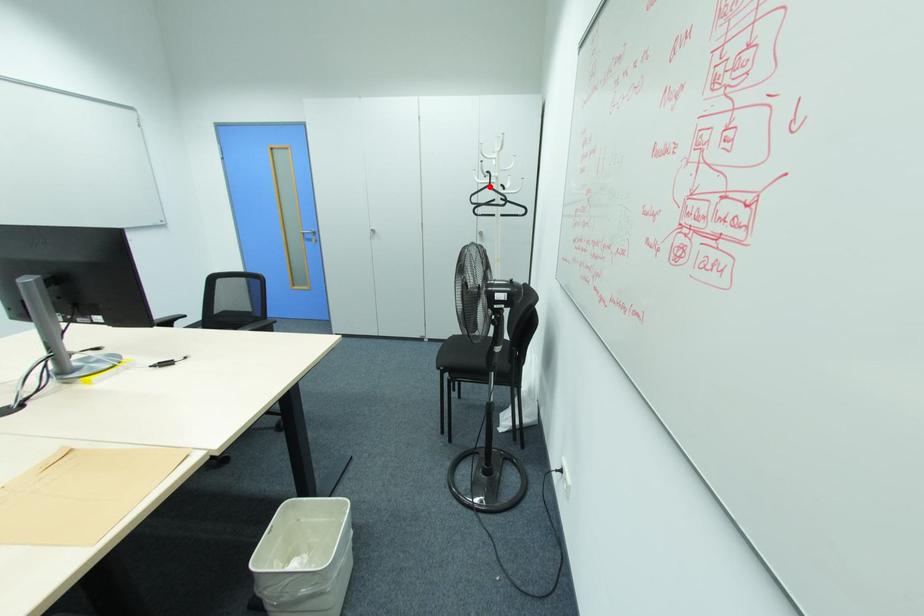
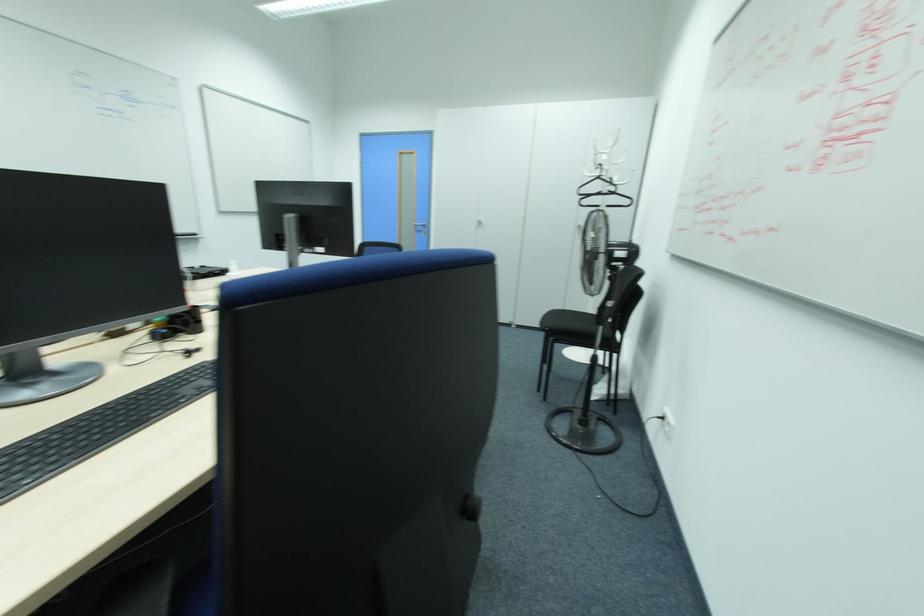
Question: I am providing you with two images of the same scene from different viewpoints. A red point is marked on the first image. Can you still see the location of the red point in image 2?

Choices:
 (A) Yes
 (B) No

Answer: (A)